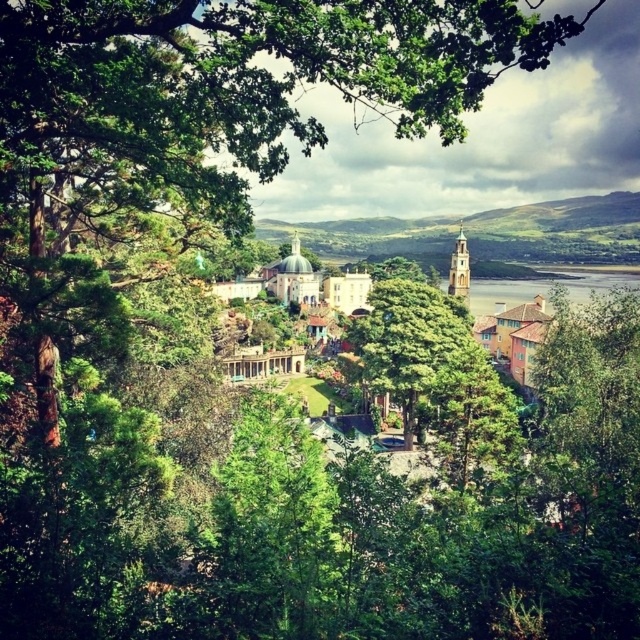
You are a hiker who wants to take a photo of the clear water at lower right without the green leafy tree at center blocking the view. Is there a way to do this by moving forward or backward?

The green leafy tree at center is in front of clear water at lower right, so moving backward might allow you to capture the clear water at lower right without the tree blocking the view.

You are standing in the town square and see two points marked on the ground. The first point is at coordinates point (396, 285) and the second point is at point (515, 300). Which point is closer to you?

Point (396, 285) is closer to the viewer than point (515, 300).

You are an architect designing a new park in the town. You need to place a statue at the point marked by the coordinates point (410, 340). Based on the scene description, what type of area will the statue be placed in?

The point (410, 340) is on a green leafy tree at center, so the statue will be placed in a green leafy tree area at the center of the scene.